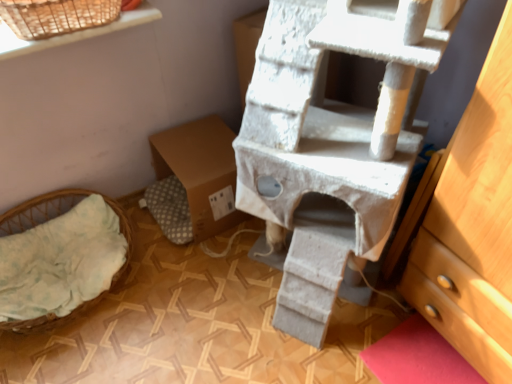
At what (x,y) coordinates should I click in order to perform the action: click on free spot above brown cardboard box at center (from a real-world perspective). Please return your answer as a coordinate pair (x, y). The width and height of the screenshot is (512, 384). Looking at the image, I should click on (194, 147).